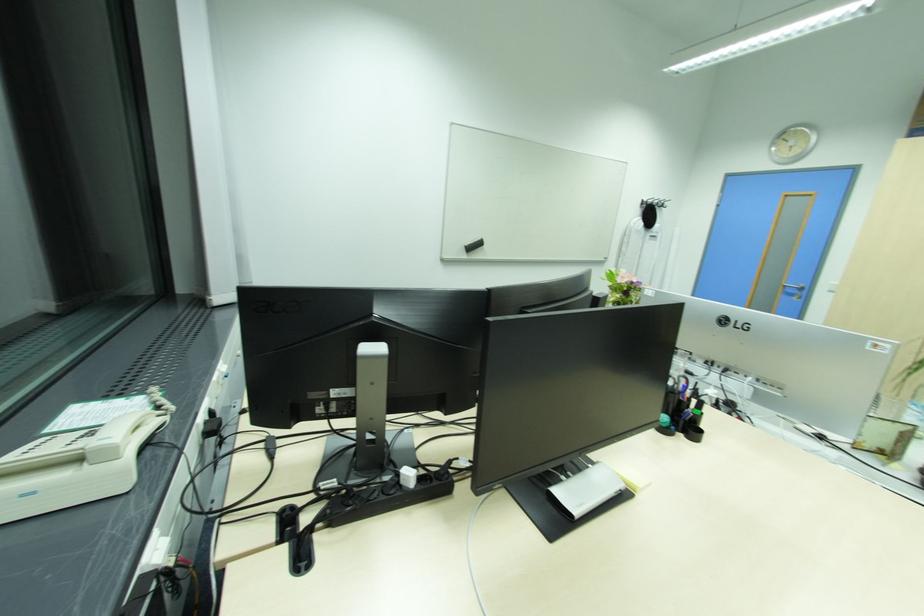
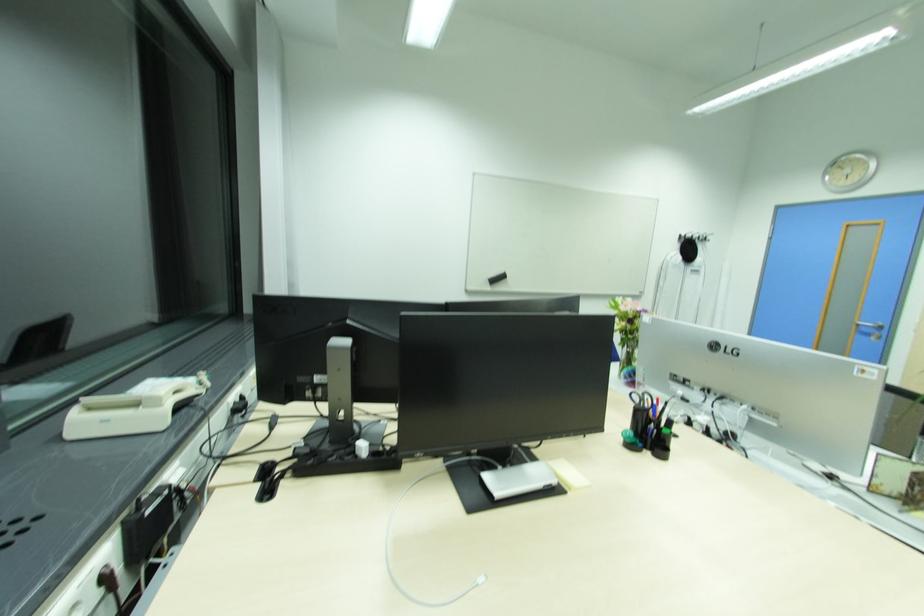
The point at (678, 428) is marked in the first image. Where is the corresponding point in the second image?

(647, 446)